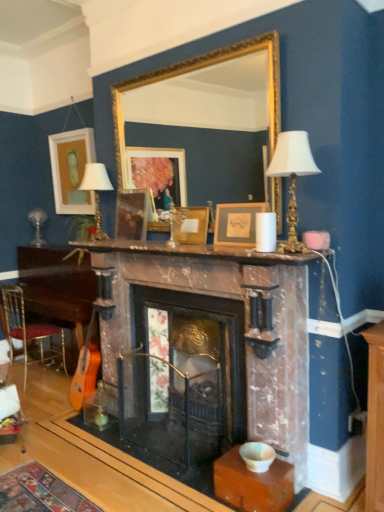
Question: In the image, is matte white lampshade at upper left, placed as the second table lamp when sorted from right to left, positioned in front of or behind marble mantel at center?

Choices:
 (A) behind
 (B) front

Answer: (A)

Question: Considering the positions of point (104, 233) and point (119, 240), is point (104, 233) closer or farther from the camera than point (119, 240)?

Choices:
 (A) closer
 (B) farther

Answer: (B)

Question: Which object is positioned farthest from the matte gold picture frame at center, arranged as the 4th picture frame when viewed from the left?

Choices:
 (A) matte white lampshade at upper left, placed as the second table lamp when sorted from right to left
 (B) gold/gilded mirror at upper center
 (C) marble fireplace at center
 (D) wooden picture frame at center, which is the 2th picture frame from left to right
 (E) white matte picture frame at upper left, the 4th picture frame when ordered from right to left

Answer: (E)

Question: Based on their relative distances, which object is farther from the marble mantel at center?

Choices:
 (A) white matte picture frame at upper left, placed as the fourth picture frame when sorted from front to back
 (B) wooden picture frame at center, the 3th picture frame from the left
 (C) wooden table at lower left
 (D) gold/gilded mirror at upper center
 (E) white porcelain table lamp at upper center, marked as the first table lamp in a front-to-back arrangement

Answer: (A)